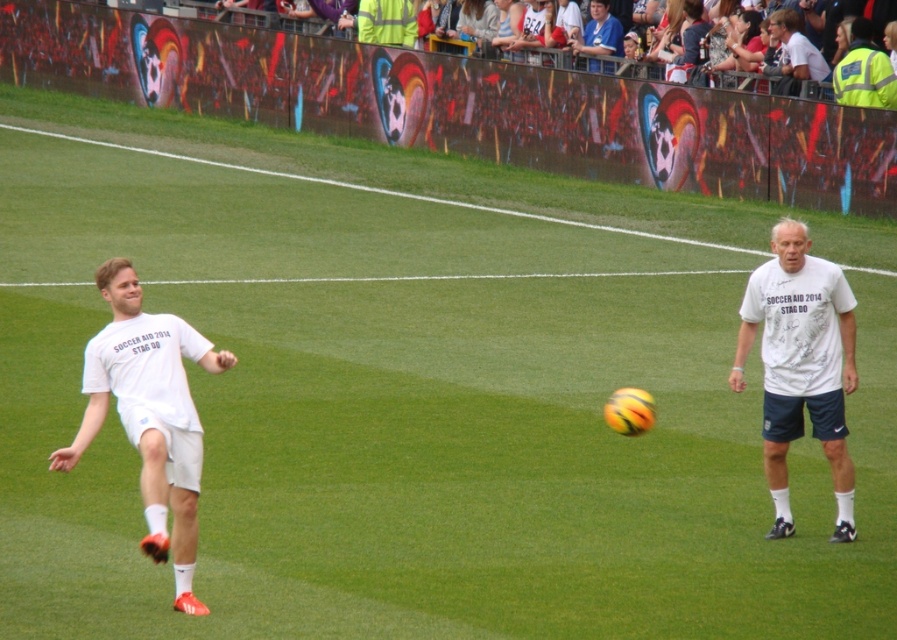
You are a soccer player standing at the point with coordinates point [810,67]. You see another point at point [800,248]. In which direction should you move to reach the other point?

To reach point [800,248] from point [810,67], you should move to the right since point [800,248] is positioned in front of point [810,67].